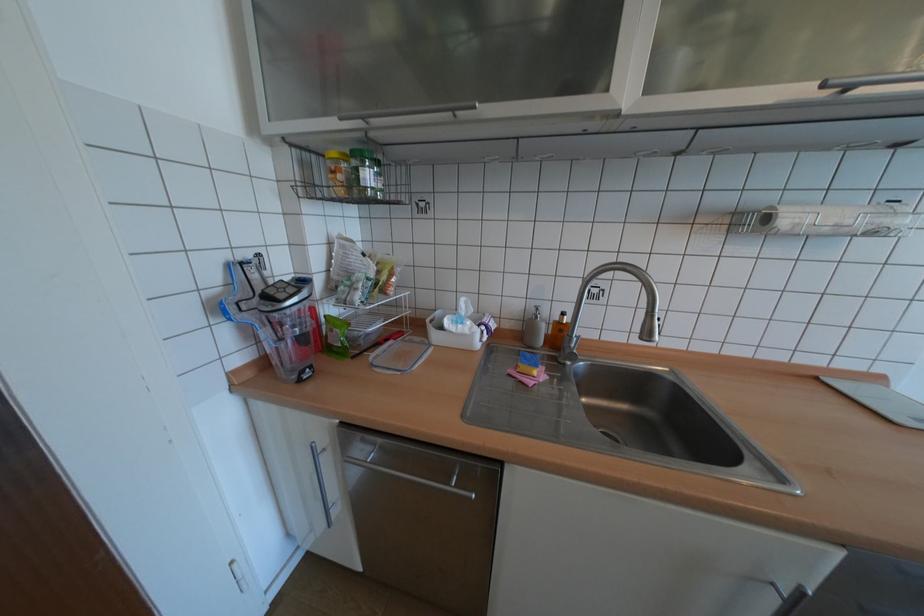
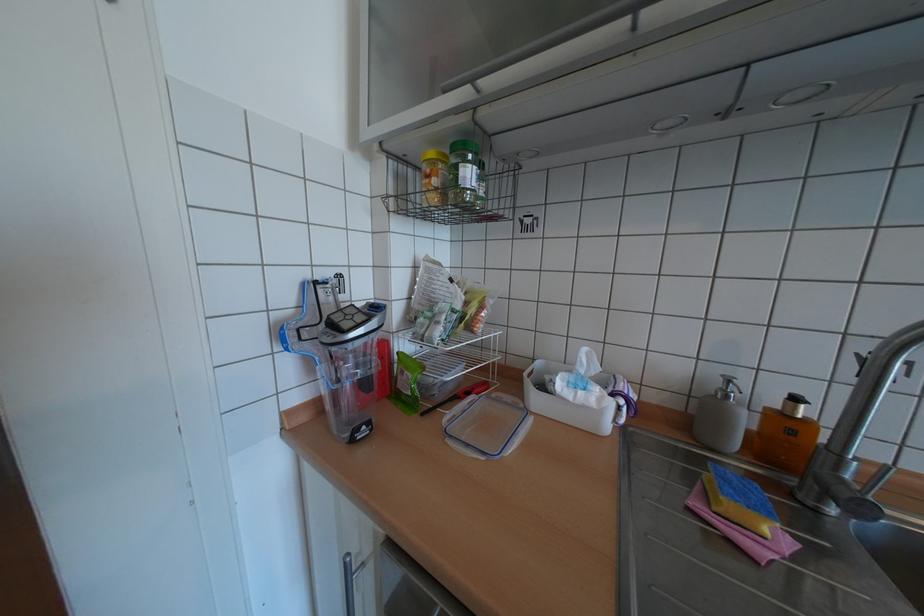
Question: How did the camera likely rotate?

Choices:
 (A) Left
 (B) Right
 (C) Up
 (D) Down

Answer: (A)